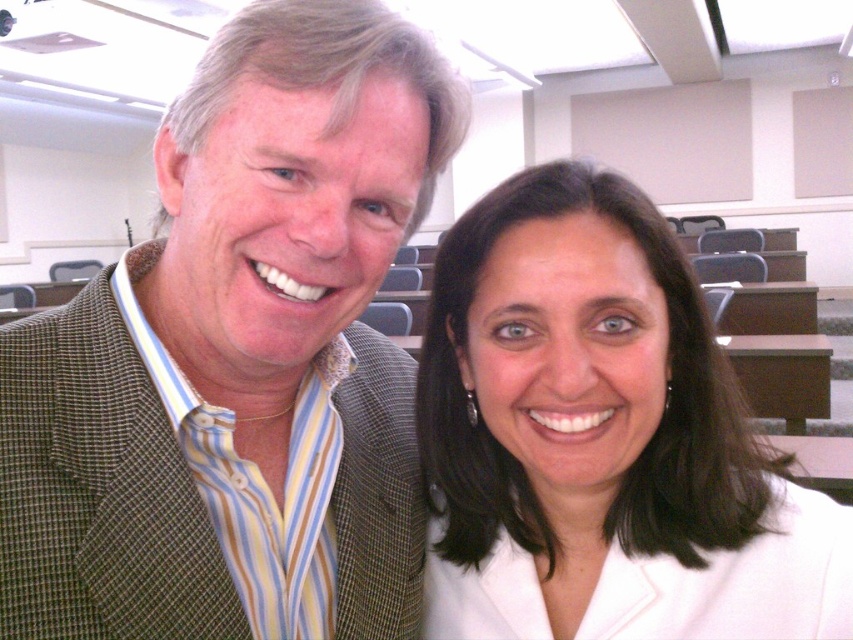
You are a photographer setting up for a group photo in the classroom. You need to ensure there is enough space between the green plaid blazer at left and the white glossy blazer at center for a camera tripod. The tripod requires at least 6 inches of space to fit. Can the tripod be placed between them?

The green plaid blazer at left and the white glossy blazer at center are 6.27 inches apart from each other. Since the required space for the tripod is 6 inches, the tripod can be placed between them as the distance is sufficient.

The man in the striped shirt and the woman in the white blazer are standing in a lecture hall. The green plaid blazer at left is part of their attire. How far apart are the two people?

The two people are 17.85 inches apart.

You are a tailor who needs to determine which blazer requires more fabric between the green plaid blazer at left and the white glossy blazer at center. Which one would need more fabric?

The white glossy blazer at center requires more fabric because its width is greater than the green plaid blazer at left.